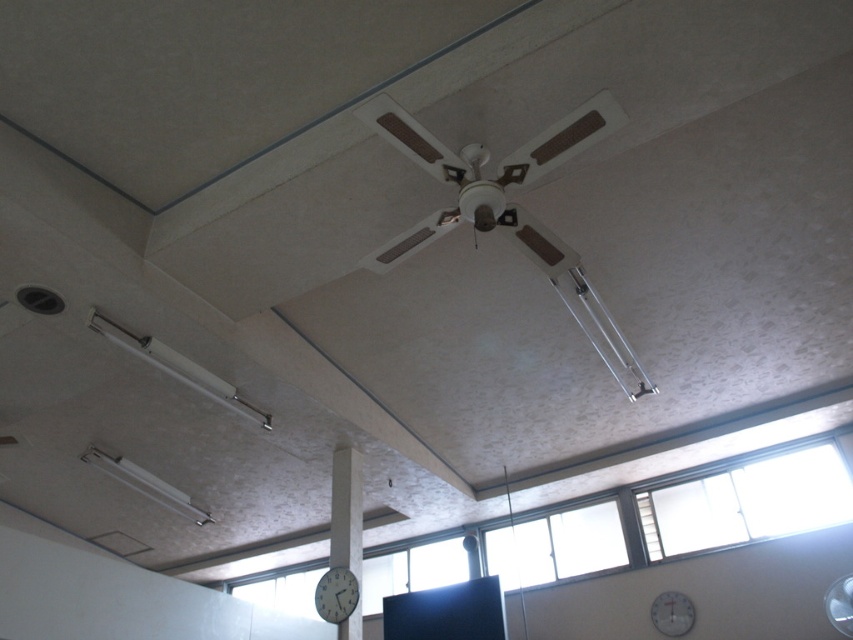
You are standing in the room and looking up at the ceiling. There are two points marked on the ceiling at coordinates point (670, 611) and point (849, 595). Which point is closer to you?

Point (849, 595) is closer to you because it is in front of point (670, 611).